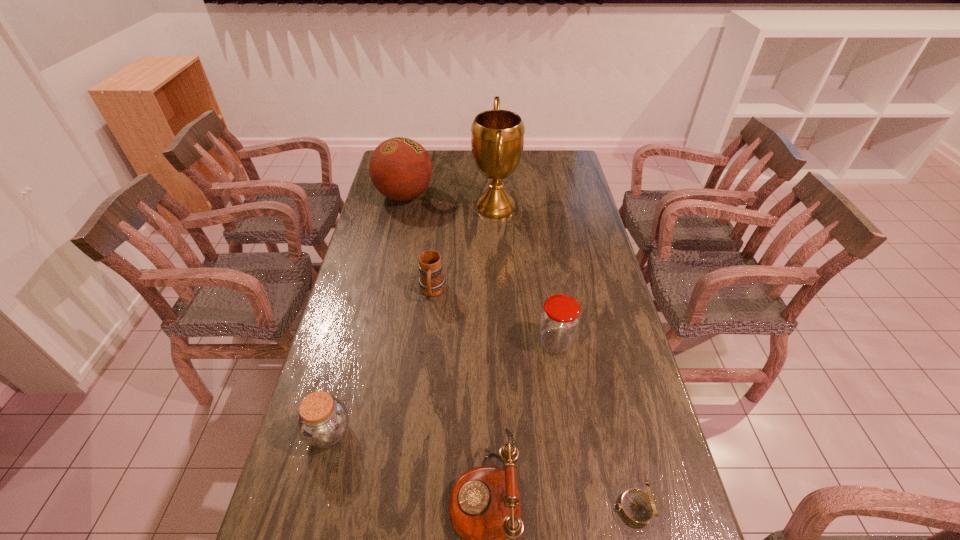
In order to click on the tallest object in this screenshot , I will do `click(497, 140)`.

Identify the location of the sixth shortest object. The image size is (960, 540). (x=400, y=168).

Identify the location of the sixth object from left to right. (560, 317).

The image size is (960, 540). What are the coordinates of `the right jar` in the screenshot? It's located at (560, 317).

This screenshot has width=960, height=540. Identify the location of mug. (431, 282).

Find the location of a particular element. the nearer jar is located at coordinates (323, 419).

The image size is (960, 540). Identify the location of the left jar. (323, 419).

Image resolution: width=960 pixels, height=540 pixels. I want to click on compass, so pos(638,507).

This screenshot has width=960, height=540. What are the coordinates of `the shortest object` in the screenshot? It's located at (638, 507).

The width and height of the screenshot is (960, 540). I want to click on vacant region located on the surface of the tallest object with symbols, so click(418, 207).